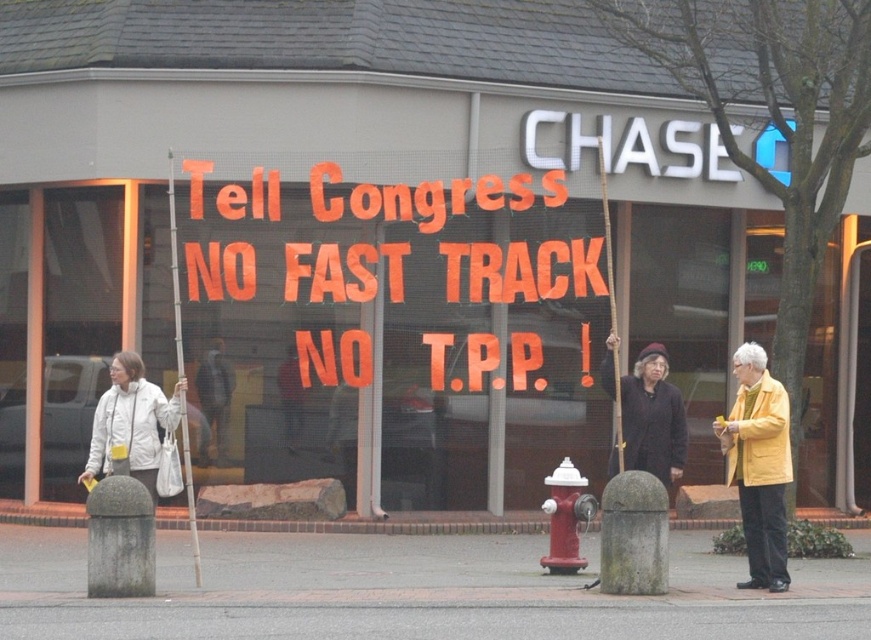
Does black wool coat at center appear under white matte jacket at lower left?

Indeed, black wool coat at center is positioned under white matte jacket at lower left.

Between black wool coat at center and white matte jacket at lower left, which one has more height?

Standing taller between the two is black wool coat at center.

Who is more forward, (625,401) or (91,429)?

Point (625,401) is in front.

Identify the location of black wool coat at center. (652, 419).

Which is above, dark gray jacket at center or metallic ladder at left?

metallic ladder at left is higher up.

The height and width of the screenshot is (640, 871). What do you see at coordinates (213, 400) in the screenshot? I see `dark gray jacket at center` at bounding box center [213, 400].

The width and height of the screenshot is (871, 640). What do you see at coordinates (213, 400) in the screenshot?
I see `dark gray jacket at center` at bounding box center [213, 400].

At what (x,y) coordinates should I click in order to perform the action: click on dark gray jacket at center. Please return your answer as a coordinate pair (x, y). The width and height of the screenshot is (871, 640). Looking at the image, I should click on (213, 400).

Who is positioned more to the left, gray concrete pavement at lower center or dark gray jacket at center?

From the viewer's perspective, dark gray jacket at center appears more on the left side.

Does gray concrete pavement at lower center appear on the left side of dark gray jacket at center?

In fact, gray concrete pavement at lower center is to the right of dark gray jacket at center.

Does point (679, 561) come behind point (213, 339)?

No.

Image resolution: width=871 pixels, height=640 pixels. Find the location of `gray concrete pavement at lower center`. gray concrete pavement at lower center is located at coordinates (413, 592).